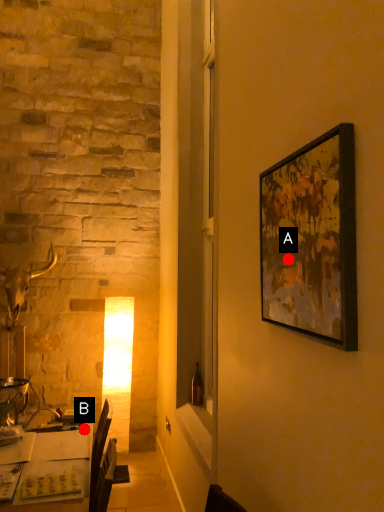
Question: Two points are circled on the image, labeled by A and B beside each circle. Which of the following is the closest to the observer?

Choices:
 (A) A is closer
 (B) B is closer

Answer: (A)